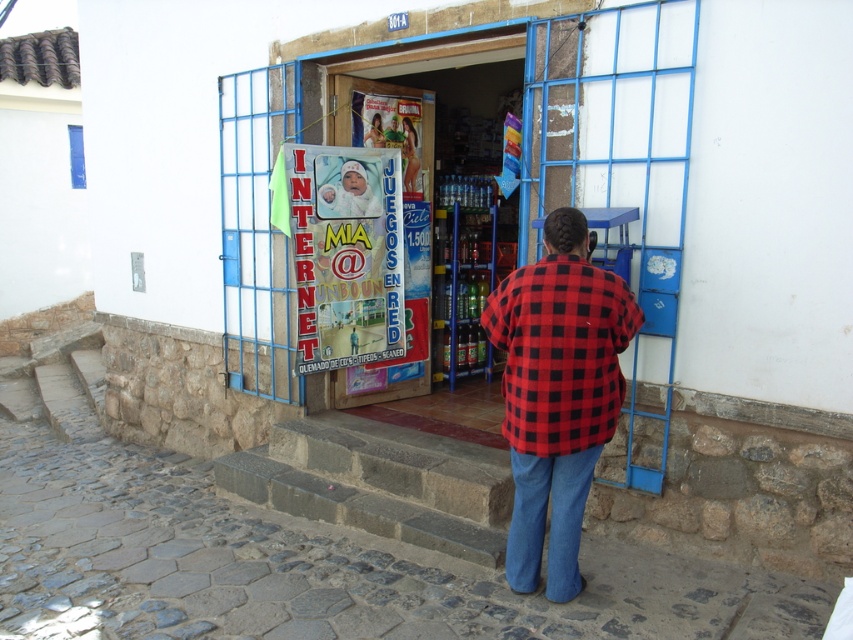
Question: Considering the real-world distances, which object is closest to the red checkered shirt at center?

Choices:
 (A) clear plastic bottles at center
 (B) blue denim jeans at lower center

Answer: (B)

Question: Which is nearer to the blue denim jeans at lower center?

Choices:
 (A) clear plastic bottles at center
 (B) red checkered shirt at center

Answer: (B)

Question: Which point appears closest to the camera in this image?

Choices:
 (A) (547, 476)
 (B) (439, 193)
 (C) (583, 492)

Answer: (C)

Question: Can you confirm if red checkered shirt at center is thinner than blue denim jeans at lower center?

Choices:
 (A) no
 (B) yes

Answer: (A)

Question: Can you confirm if red checkered shirt at center is bigger than clear plastic bottles at center?

Choices:
 (A) no
 (B) yes

Answer: (A)

Question: Does clear plastic bottles at center come behind blue denim jeans at lower center?

Choices:
 (A) no
 (B) yes

Answer: (B)